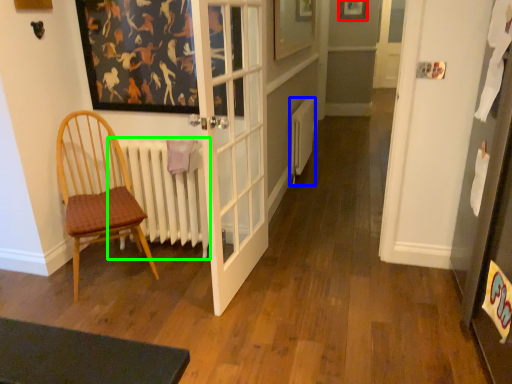
Question: Which object is the closest to the picture frame (highlighted by a red box)? Choose among these: heater (highlighted by a blue box) or radiator (highlighted by a green box).

Choices:
 (A) heater
 (B) radiator

Answer: (A)